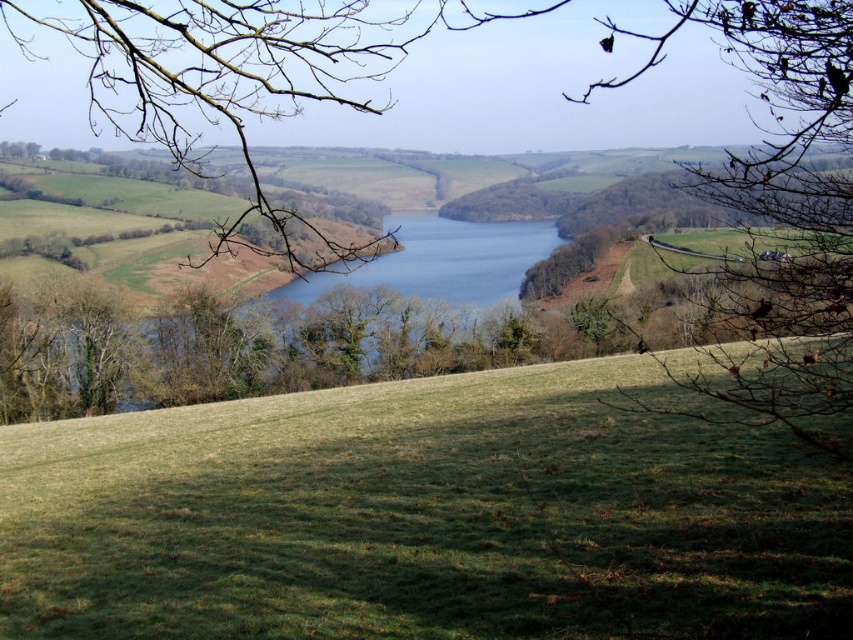
Question: Among these points, which one is farthest from the camera?

Choices:
 (A) (111, 10)
 (B) (3, 522)

Answer: (A)

Question: Does green grassy hillside at center have a greater width compared to brown leafless branch at upper center?

Choices:
 (A) yes
 (B) no

Answer: (B)

Question: Can you confirm if green grassy hillside at center is smaller than brown leafless branch at upper center?

Choices:
 (A) yes
 (B) no

Answer: (A)

Question: Considering the relative positions of green grassy hillside at center and brown leafless branch at upper center in the image provided, where is green grassy hillside at center located with respect to brown leafless branch at upper center?

Choices:
 (A) above
 (B) below

Answer: (B)

Question: Among these objects, which one is nearest to the camera?

Choices:
 (A) green grassy hillside at center
 (B) brown leafless branch at upper center

Answer: (B)